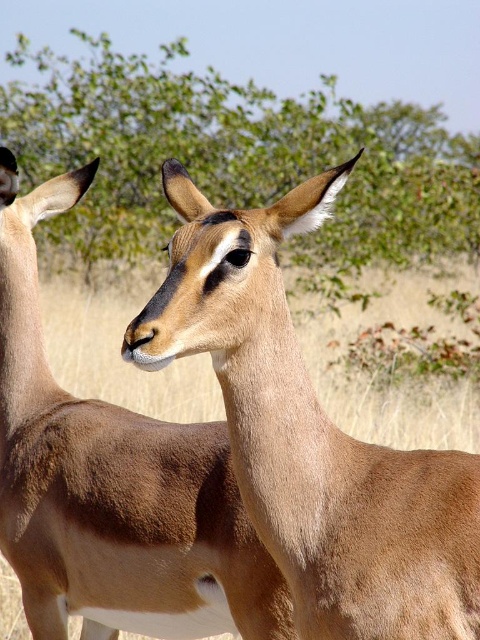
Question: Which object is farther from the camera taking this photo?

Choices:
 (A) light brown fur at center
 (B) green leafy tree at upper center
 (C) brown matte antelope at center

Answer: (B)

Question: Observing the image, what is the correct spatial positioning of light brown fur at center in reference to brown matte antelope at center?

Choices:
 (A) left
 (B) right

Answer: (B)

Question: Is the position of light brown fur at center less distant than that of brown matte antelope at center?

Choices:
 (A) no
 (B) yes

Answer: (B)

Question: Estimate the real-world distances between objects in this image. Which object is closer to the green leafy tree at upper center?

Choices:
 (A) brown matte antelope at center
 (B) light brown fur at center

Answer: (A)

Question: Does light brown fur at center appear under brown matte antelope at center?

Choices:
 (A) no
 (B) yes

Answer: (A)

Question: Which object is farther from the camera taking this photo?

Choices:
 (A) light brown fur at center
 (B) brown matte antelope at center

Answer: (B)